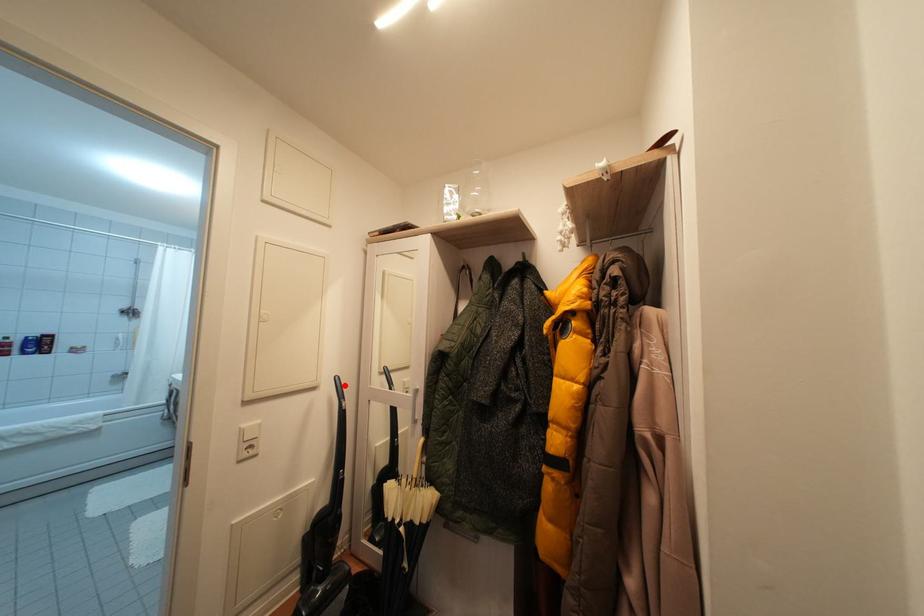
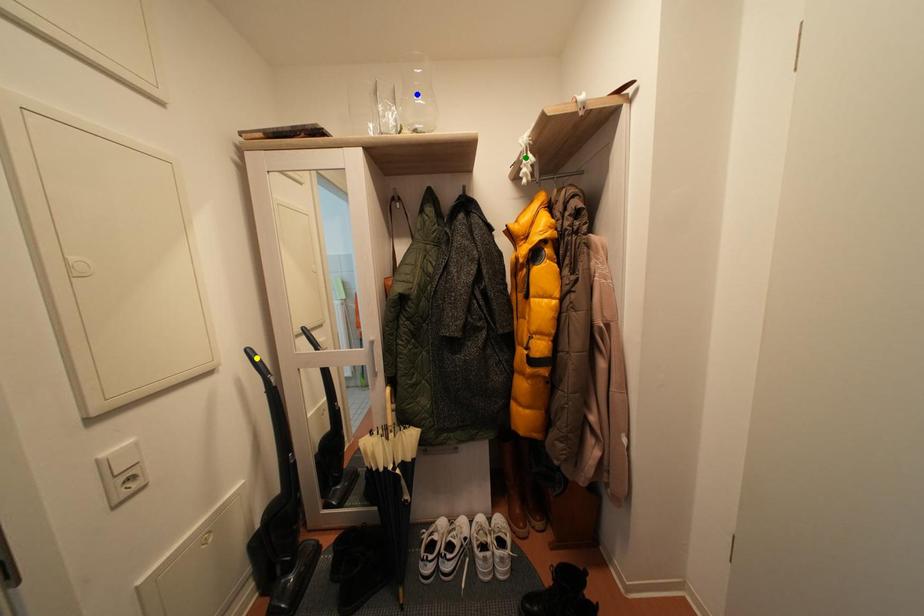
Question: I am providing you with two images of the same scene from different viewpoints. A red point is marked on the first image. You are given multiple points on the second image. Which point in image 2 represents the same 3d spot as the red point in image 1?

Choices:
 (A) green point
 (B) yellow point
 (C) blue point

Answer: (B)